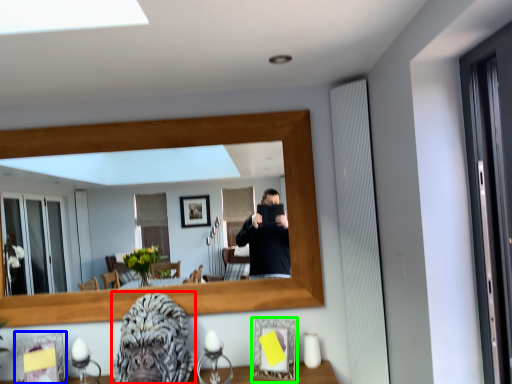
Question: Which object is the closest to the gorilla (highlighted by a red box)? Choose among these: picture frame (highlighted by a blue box) or picture frame (highlighted by a green box).

Choices:
 (A) picture frame
 (B) picture frame

Answer: (B)